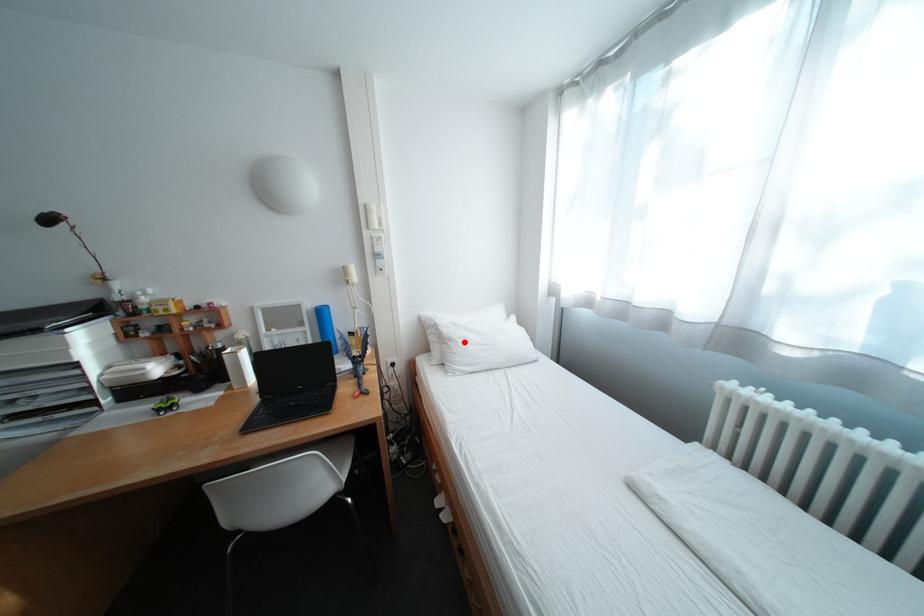
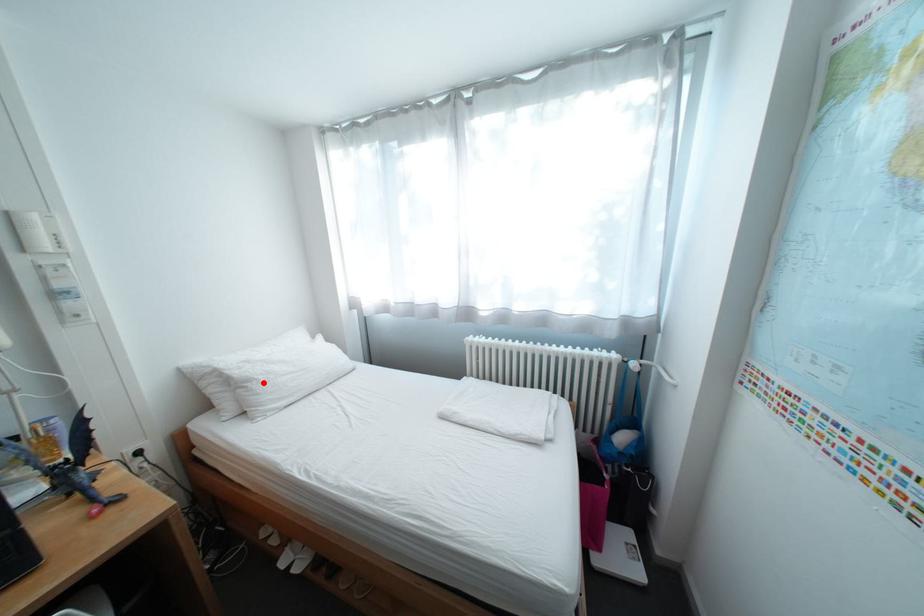
Consider the image. I am providing you with two images of the same scene from different viewpoints. A red point is marked on the first image and another point is marked on the second image. Are the points marked in image1 and image2 representing the same 3D position?

Yes